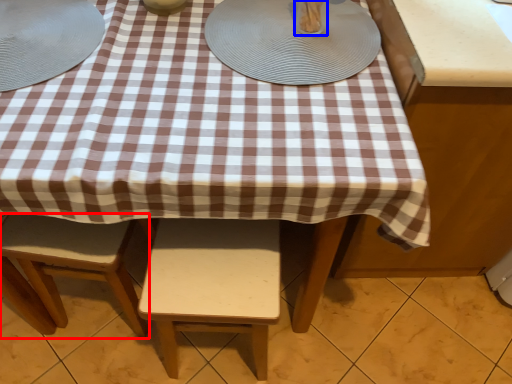
Question: Which point is further to the camera, stool (highlighted by a red box) or tableware (highlighted by a blue box)?

Choices:
 (A) stool
 (B) tableware

Answer: (A)